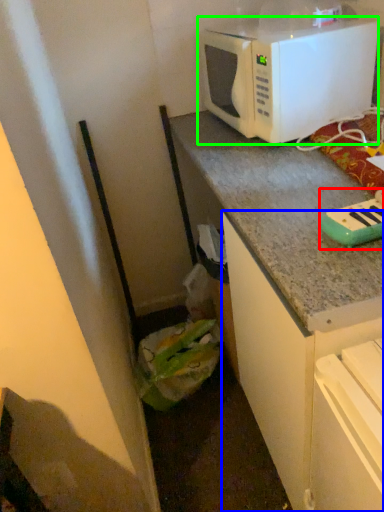
Question: Estimate the real-world distances between objects in this image. Which object is farther from appliance (highlighted by a red box), cabinetry (highlighted by a blue box) or microwave oven (highlighted by a green box)?

Choices:
 (A) cabinetry
 (B) microwave oven

Answer: (B)